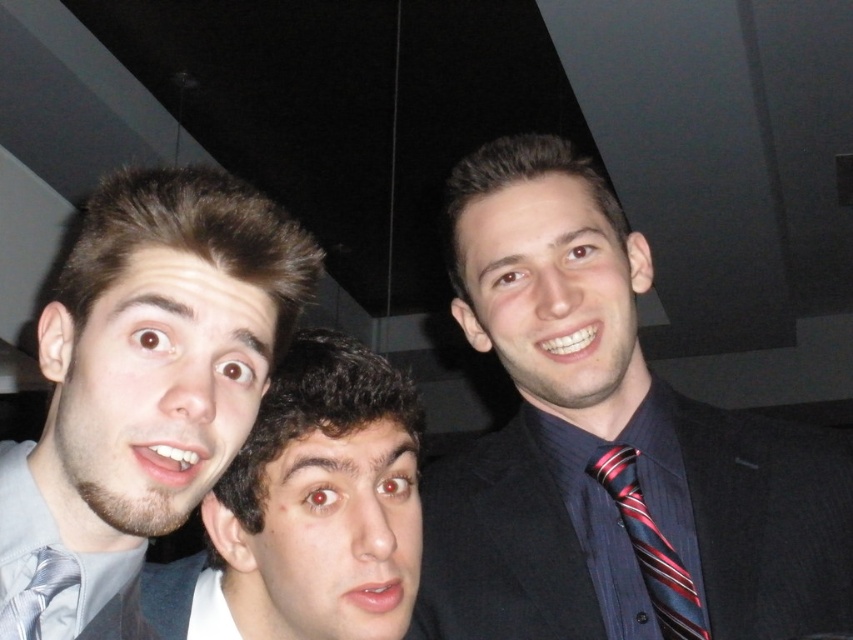
You are taking a photo of two points in a dimly lit indoor setting. The first point is at coordinates point (138, 280) and the second is at point (689, 580). Which point will appear larger in the photo?

Point (138, 280) will appear larger in the photo because it is closer to the camera than point (689, 580).